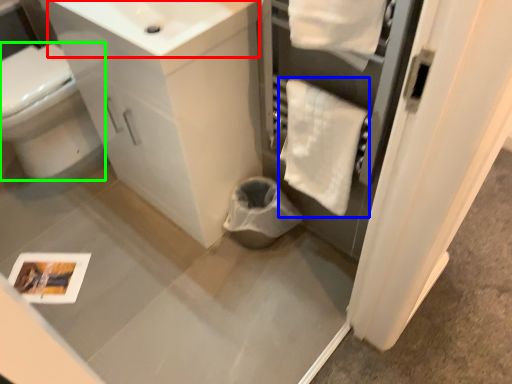
Question: Based on their relative distances, which object is farther from sink (highlighted by a red box)? Choose from bath towel (highlighted by a blue box) and bidet (highlighted by a green box).

Choices:
 (A) bath towel
 (B) bidet

Answer: (B)